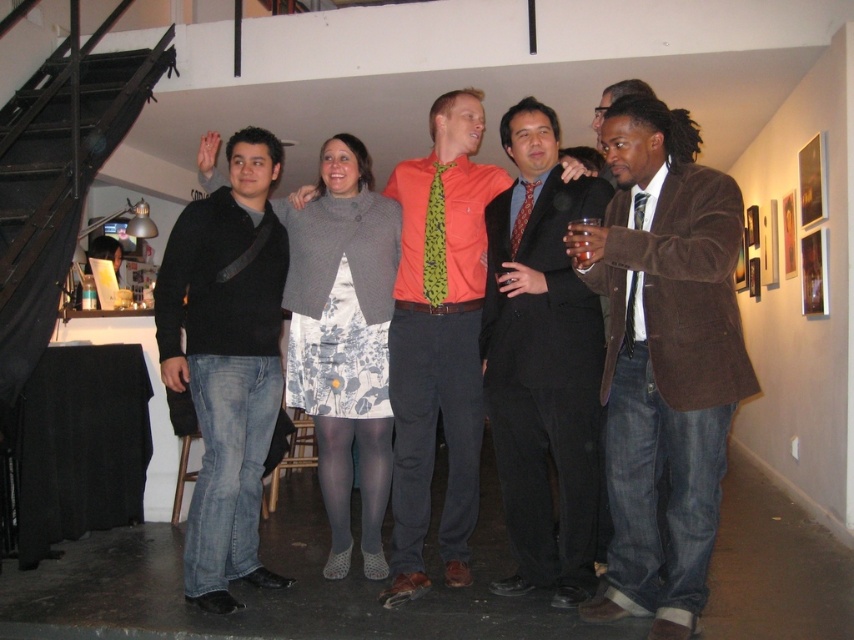
Question: Can you confirm if brown corduroy blazer at right is positioned to the right of dark brown wooden stairs at left?

Choices:
 (A) no
 (B) yes

Answer: (B)

Question: Which point appears farthest from the camera in this image?

Choices:
 (A) (629, 326)
 (B) (691, 320)
 (C) (572, 289)

Answer: (C)

Question: Does orange cotton shirt at center have a larger size compared to red patterned tie at center?

Choices:
 (A) no
 (B) yes

Answer: (B)

Question: Is black matte sweater at left to the left of green leafy fabric tie at center from the viewer's perspective?

Choices:
 (A) yes
 (B) no

Answer: (A)

Question: Which object is the closest to the black matte sweater at left?

Choices:
 (A) silky black tie at right
 (B) matte black suit at center
 (C) brown corduroy blazer at right
 (D) orange cotton shirt at center

Answer: (D)

Question: Which object is the farthest from the black matte sweater at left?

Choices:
 (A) dark brown wooden stairs at left
 (B) orange cotton shirt at center
 (C) matte black suit at center

Answer: (C)